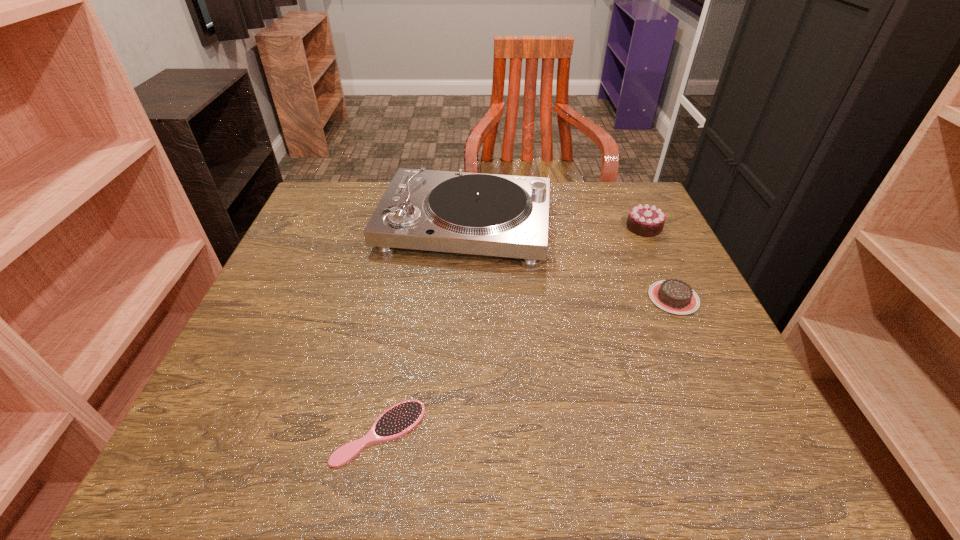
Identify the location of vacant area at the near right corner of the desktop. The width and height of the screenshot is (960, 540). (709, 441).

This screenshot has height=540, width=960. I want to click on free spot between the nearer chocolate cake and the tallest object, so click(x=569, y=261).

This screenshot has width=960, height=540. What are the coordinates of `vacant point located between the shorter chocolate cake and the record player` in the screenshot? It's located at (569, 261).

What are the coordinates of `free space between the nearer chocolate cake and the shortest object` in the screenshot? It's located at (527, 365).

The height and width of the screenshot is (540, 960). I want to click on free point between the shorter chocolate cake and the hairbrush, so click(527, 365).

The image size is (960, 540). Find the location of `vacant point located between the farther chocolate cake and the tallest object`. vacant point located between the farther chocolate cake and the tallest object is located at coordinates (554, 226).

What are the coordinates of `unoccupied area between the shortest object and the shorter chocolate cake` in the screenshot? It's located at (527, 365).

This screenshot has height=540, width=960. I want to click on unoccupied area between the nearest object and the third farthest object, so click(527, 365).

I want to click on empty space that is in between the second shortest object and the record player, so click(x=569, y=261).

This screenshot has height=540, width=960. I want to click on free space between the tallest object and the shortest object, so click(x=422, y=328).